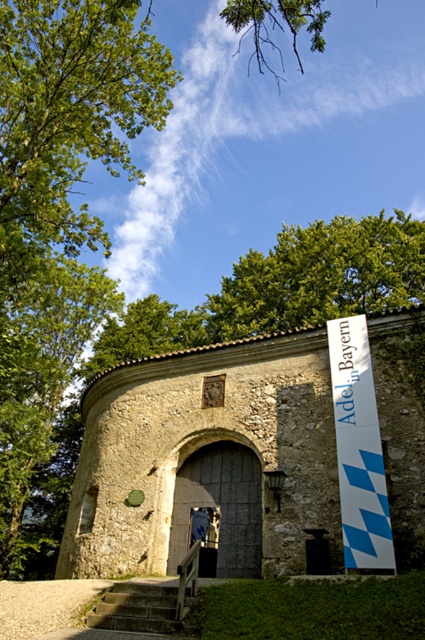
Which is behind, point (306, 305) or point (187, 600)?

Point (306, 305)

Is green leafy tree at upper center to the left of concrete stairs at lower center from the viewer's perspective?

No, green leafy tree at upper center is not to the left of concrete stairs at lower center.

Is point (340, 275) positioned in front of point (116, 593)?

No, it is behind (116, 593).

Where is `green leafy tree at upper center`? This screenshot has height=640, width=425. green leafy tree at upper center is located at coordinates (320, 275).

Who is positioned more to the left, blue and white checkered banner at right or concrete stairs at lower center?

concrete stairs at lower center

Can you confirm if blue and white checkered banner at right is taller than concrete stairs at lower center?

Incorrect, blue and white checkered banner at right's height is not larger of concrete stairs at lower center's.

Where is `blue and white checkered banner at right`? The width and height of the screenshot is (425, 640). blue and white checkered banner at right is located at coordinates (359, 449).

The width and height of the screenshot is (425, 640). What do you see at coordinates (320, 275) in the screenshot?
I see `green leafy tree at upper center` at bounding box center [320, 275].

Does green leafy tree at upper center have a larger size compared to blue and white checkered banner at right?

Correct, green leafy tree at upper center is larger in size than blue and white checkered banner at right.

Which is behind, point (351, 291) or point (342, 406)?

The point (351, 291) is more distant.

The height and width of the screenshot is (640, 425). In order to click on green leafy tree at upper center in this screenshot , I will do `click(320, 275)`.